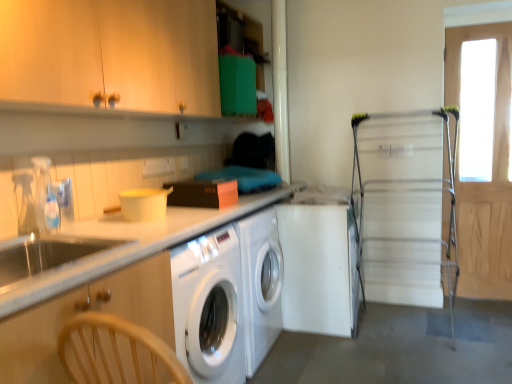
Where is `free space in front of white matte washing machine at center`? free space in front of white matte washing machine at center is located at coordinates (338, 357).